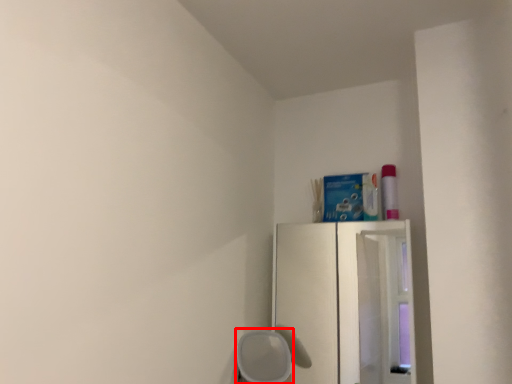
Question: From the image's perspective, what is the correct spatial relationship of furniture (annotated by the red box) in relation to fridge?

Choices:
 (A) below
 (B) above

Answer: (A)